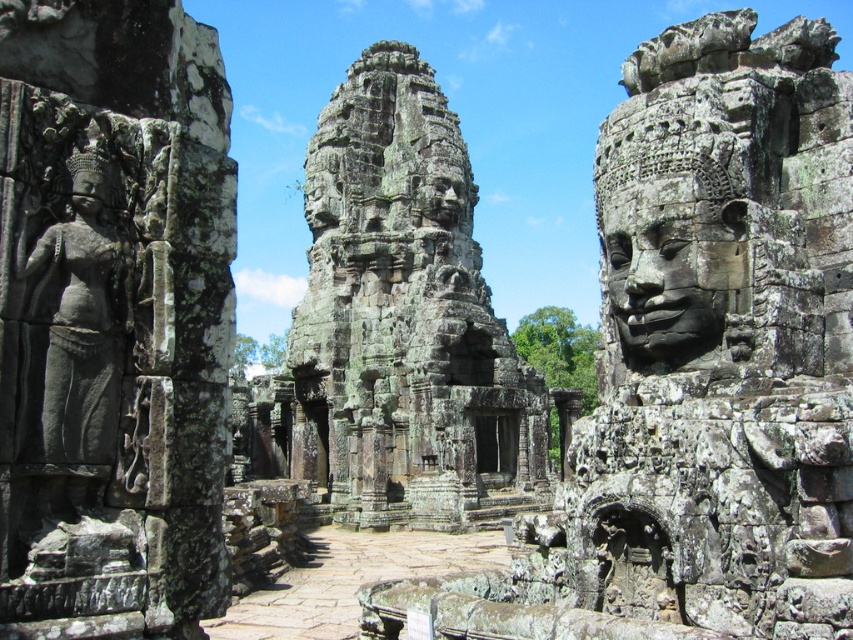
Question: Which object is the farthest from the gray stone statue at left?

Choices:
 (A) dark gray stone head at left
 (B) matte stone face at left
 (C) carved stone face at right
 (D) rough stone temple at center

Answer: (D)

Question: Is carved stone face at right below dark gray stone head at left?

Choices:
 (A) yes
 (B) no

Answer: (A)

Question: Which is nearer to the gray stone statue at left?

Choices:
 (A) matte stone face at left
 (B) dark gray stone head at left
 (C) carved stone face at right

Answer: (A)

Question: Which of the following is the closest to the observer?

Choices:
 (A) (506, 419)
 (B) (96, 196)

Answer: (B)

Question: Is rough stone temple at center positioned at the back of gray stone statue at left?

Choices:
 (A) no
 (B) yes

Answer: (B)

Question: Does carved stone face at right have a larger size compared to matte stone face at left?

Choices:
 (A) yes
 (B) no

Answer: (B)